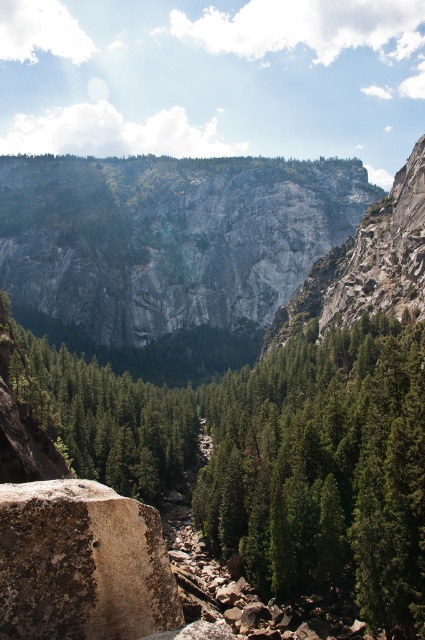
Question: Estimate the real-world distances between objects in this image. Which object is farther from the gray rock cliff at center?

Choices:
 (A) green matte tree at center
 (B) rusty brown rock at lower left

Answer: (B)

Question: Does green matte tree at center appear over rusty brown rock at lower left?

Choices:
 (A) no
 (B) yes

Answer: (B)

Question: Is green matte tree at center to the right of gray rock cliff at center from the viewer's perspective?

Choices:
 (A) yes
 (B) no

Answer: (A)

Question: Which point is closer to the camera taking this photo?

Choices:
 (A) (269, 563)
 (B) (283, 291)

Answer: (A)

Question: Which point appears closest to the camera in this image?

Choices:
 (A) (353, 328)
 (B) (212, 296)
 (C) (144, 577)

Answer: (C)

Question: Is green matte tree at center positioned at the back of rusty brown rock at lower left?

Choices:
 (A) yes
 (B) no

Answer: (A)